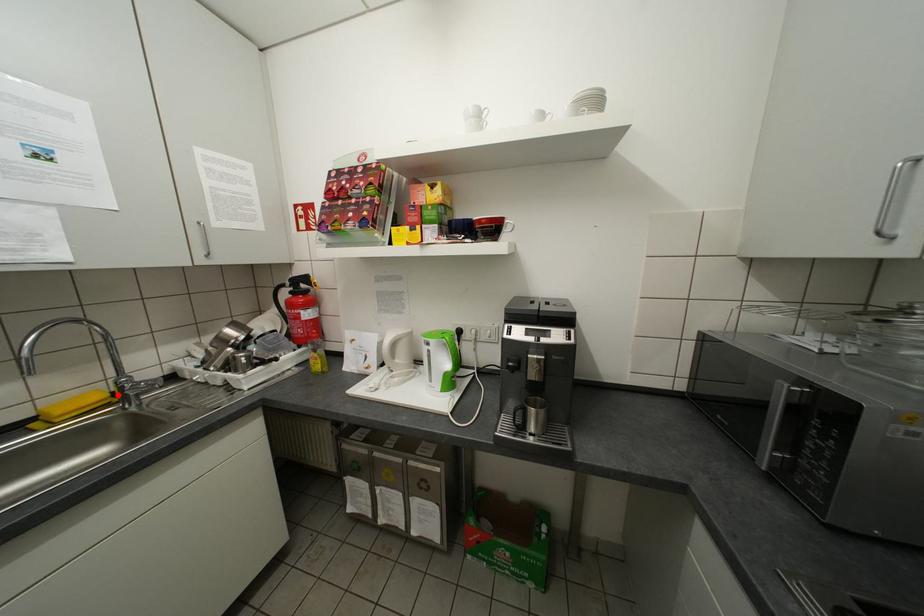
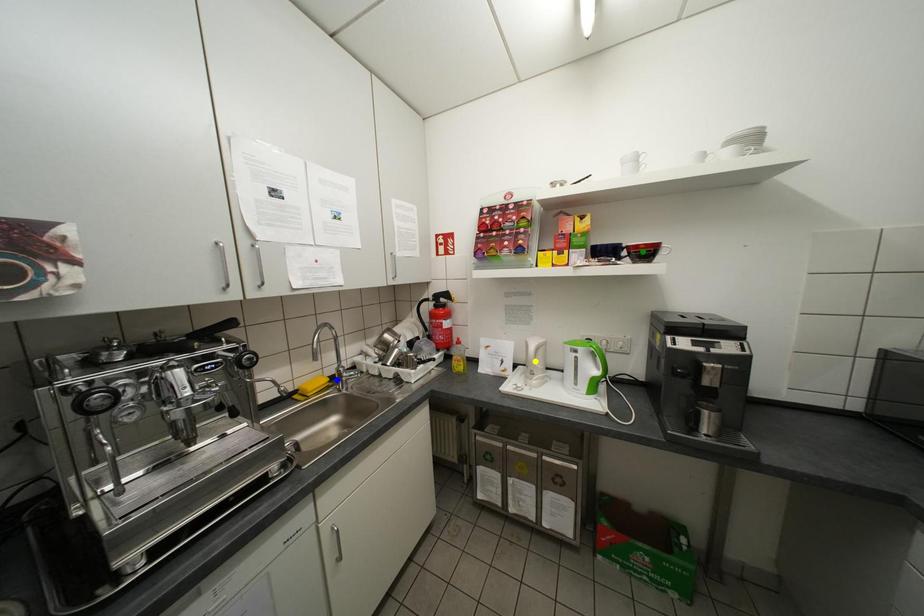
Question: I am providing you with two images of the same scene from different viewpoints. A red point is marked on the first image. You are given multiple points on the second image. Can you choose the point in image 2 that corresponds to the point in image 1?

Choices:
 (A) green point
 (B) yellow point
 (C) blue point

Answer: (C)